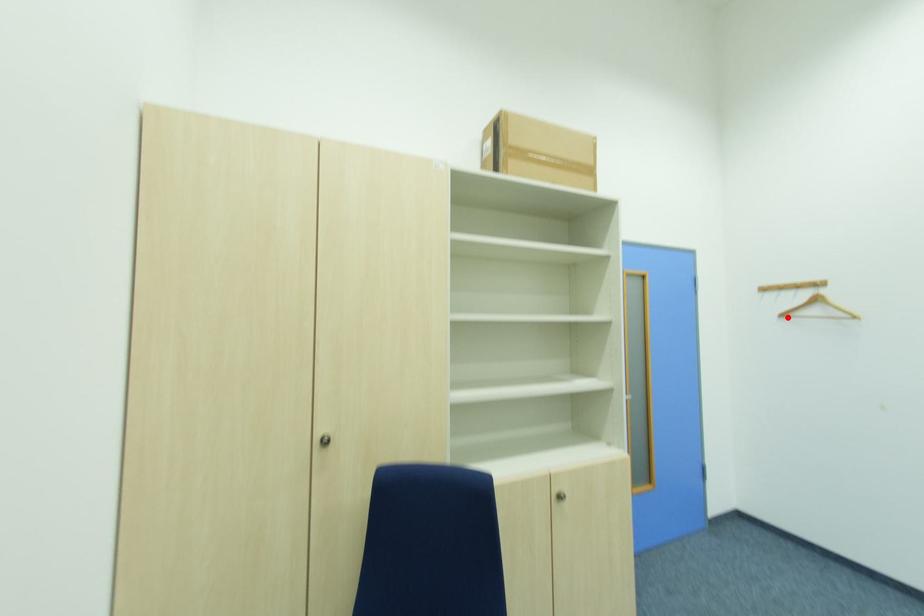
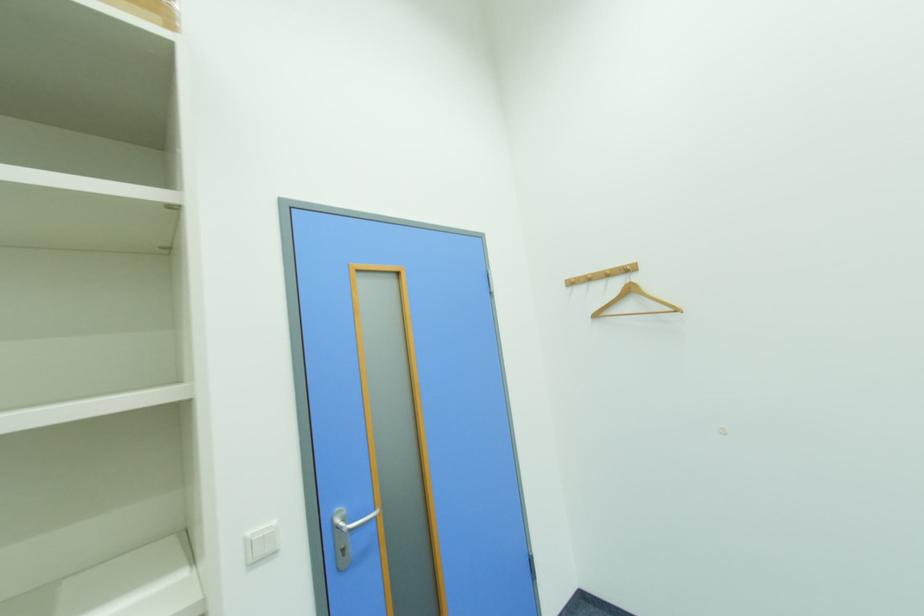
The point at the highlighted location is marked in the first image. Where is the corresponding point in the second image?

(601, 317)